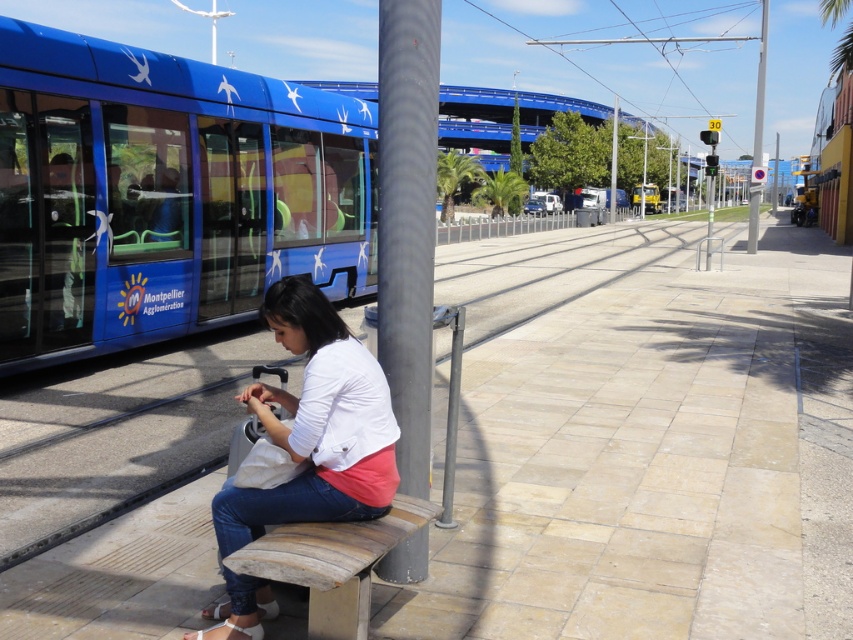
You are standing at the tram station and want to locate the black textured pole at center. According to the coordinates provided, where should you look?

The black textured pole at center is located at point (407, 221).

You are a tram operator who needs to ensure the tram doesn not hit the pole. Given the distance between the blue glossy tram at left and the metallic pole at upper right, can you safely stop the tram before reaching the pole?

The blue glossy tram at left is 27.24 meters away from the metallic pole at upper right. To determine if it can safely stop, we need to know the tram speed and braking distance. Since this information isn t provided, we can t confirm safety.

You need to determine if the blue glossy tram at left can fit entirely behind the wooden bench at center without overlapping. Based on their sizes, what do you think?

The blue glossy tram at left is wider than the wooden bench at center, so it cannot fit entirely behind the bench without overlapping.